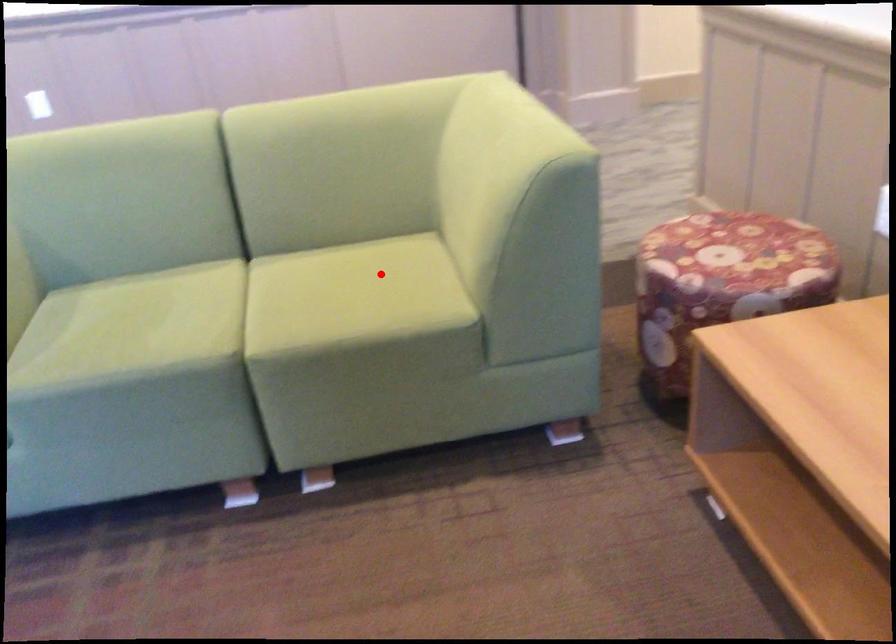
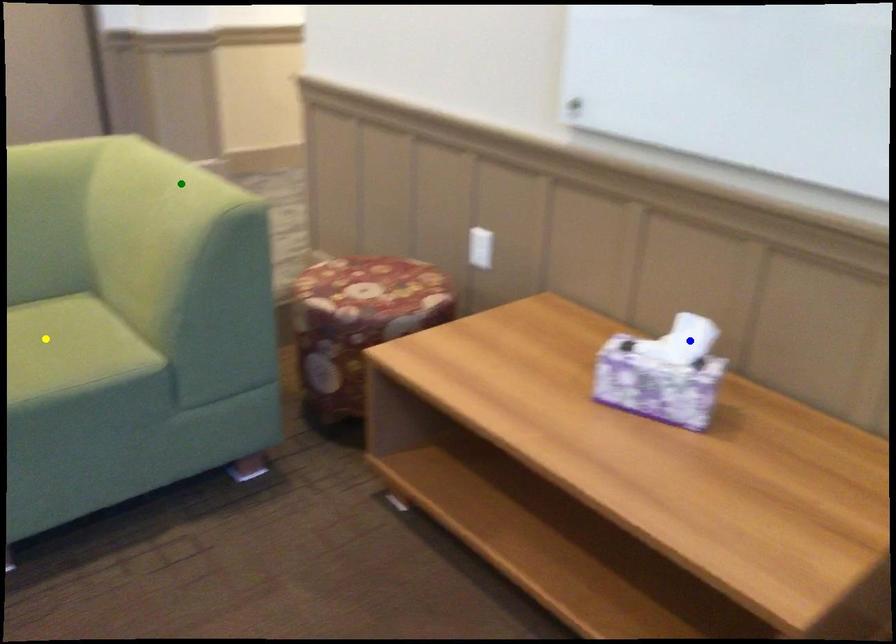
Question: I am providing you with two images of the same scene from different viewpoints. A red point is marked on the first image. You are given multiple points on the second image. Which mark in image 2 goes with the point in image 1?

Choices:
 (A) blue point
 (B) yellow point
 (C) green point

Answer: (B)